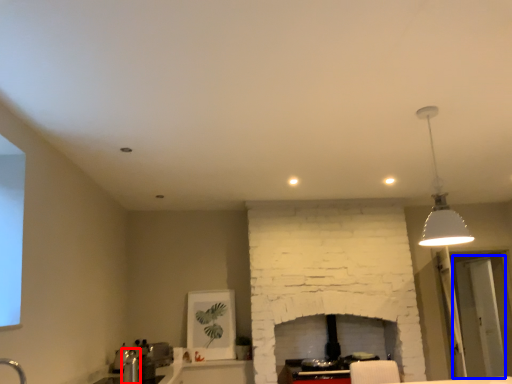
Question: Among these objects, which one is nearest to the camera, faucet (highlighted by a red box) or glass door (highlighted by a blue box)?

Choices:
 (A) faucet
 (B) glass door

Answer: (A)